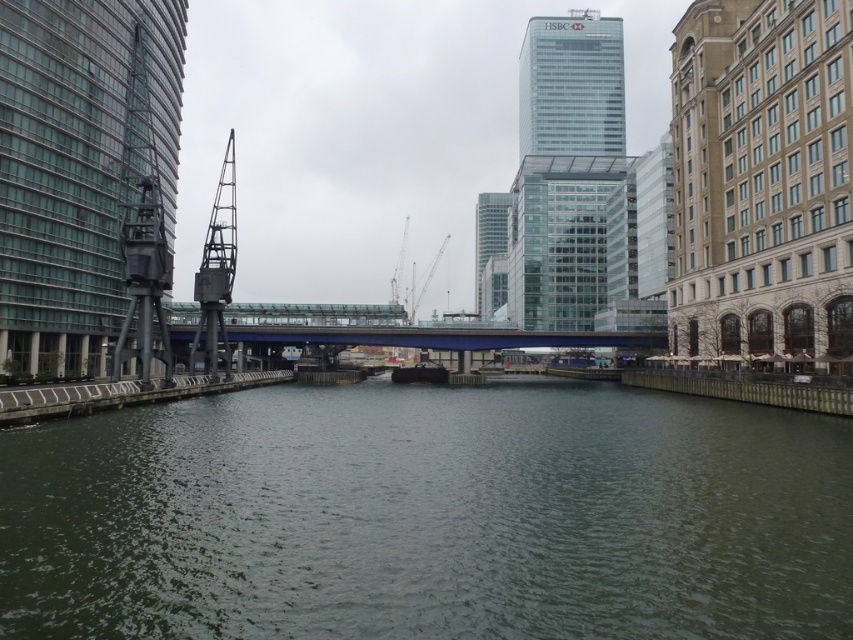
Based on the cityscape scene, where is the green water at center located in terms of coordinates?

The green water at center is located at coordinates point (428, 516).

You are a city planner analyzing the riverfront area. You need to determine which structure is taller between the blue metallic bridge at center and the glassy reflective skyscraper at center. Based on the scene, which one is taller?

The glassy reflective skyscraper at center is taller than the blue metallic bridge at center.

You are standing at the pedestrian bridge and want to take a photo of both point (175, 500) and point (503, 250) in the cityscape. Which point should you focus on first to ensure both are in clear view?

You should focus on point (175, 500) first because it is closer to the camera than point (503, 250). This ensures both points will be in focus as the depth of field can cover the distance between them.